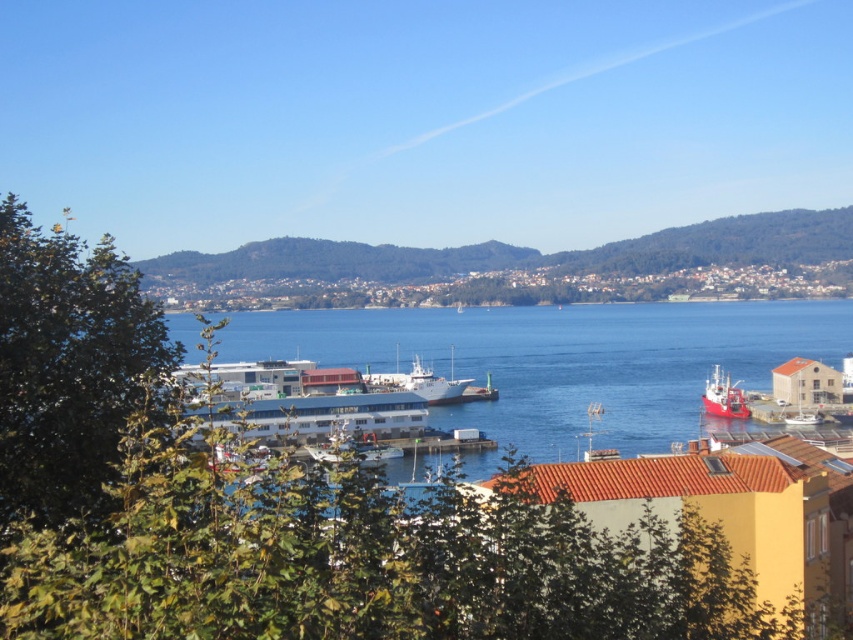
You are a photographer positioned at the harbor edge. You want to capture both the white matte ship at center and the red matte boat at right in a single shot. Based on their positions, which one will appear closer to the camera in your photo?

The white matte ship at center appears closer to the camera because it is positioned in front of the red matte boat at right.

You are a photographer planning to capture the harbor scene. You want to ensure that the blue water at center and the red matte boat at right are both visible in your shot. Given their sizes, which object should you frame first to ensure it occupies more space in the photo?

The blue water at center is bigger than the red matte boat at right, so you should frame the blue water at center first to ensure it occupies more space in the photo.

You are a tourist standing at the edge of the harbor looking out. You see the blue water at center and the red matte boat at right. Which object is higher in the image?

The blue water at center is located above the red matte boat at right, so the blue water at center is higher in the image.